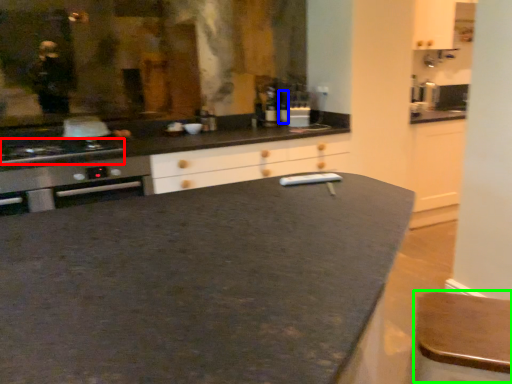
Question: Estimate the real-world distances between objects in this image. Which object is farther from kitchen appliance (highlighted by a red box), bottle (highlighted by a blue box) or bar stool (highlighted by a green box)?

Choices:
 (A) bottle
 (B) bar stool

Answer: (B)